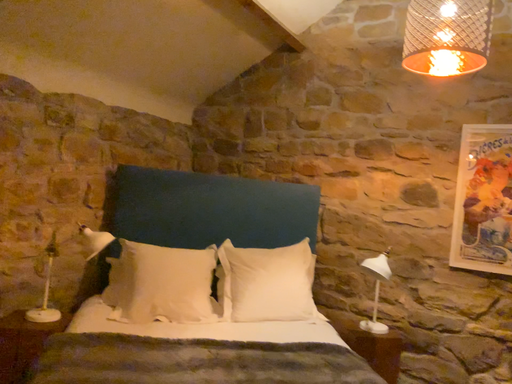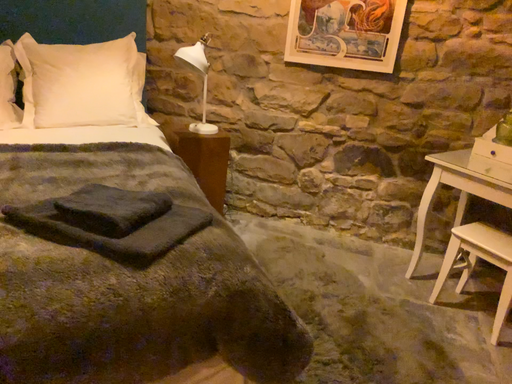
Question: How did the camera likely rotate when shooting the video?

Choices:
 (A) rotated right
 (B) rotated left

Answer: (A)